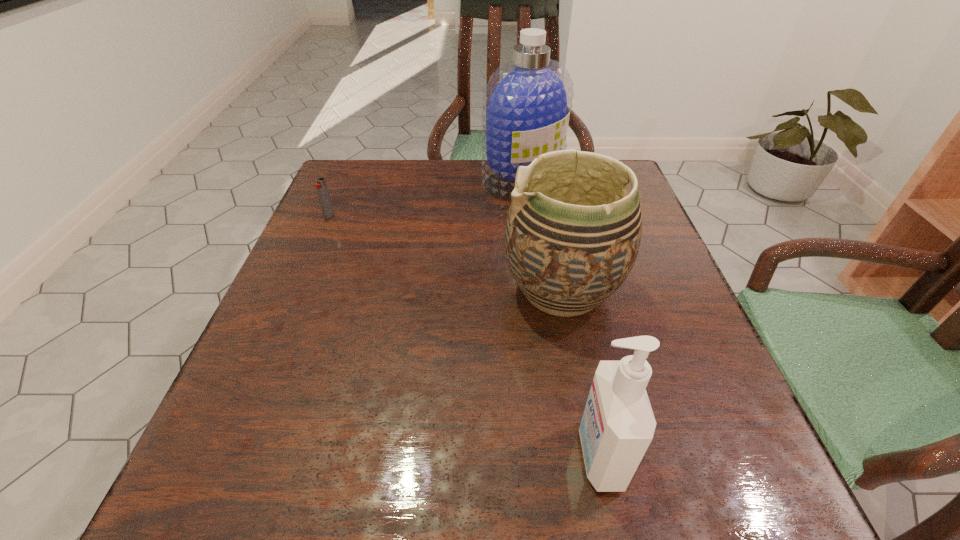
This screenshot has width=960, height=540. What are the coordinates of `the tallest object` in the screenshot? It's located at (526, 104).

Locate an element on the screen. The width and height of the screenshot is (960, 540). the taller cleansing agent is located at coordinates (526, 104).

This screenshot has height=540, width=960. Identify the location of the third farthest object. point(572,236).

Where is `the shorter cleansing agent`? The width and height of the screenshot is (960, 540). the shorter cleansing agent is located at coordinates (618, 424).

Locate an element on the screen. Image resolution: width=960 pixels, height=540 pixels. the nearer cleansing agent is located at coordinates (618, 424).

Where is `igniter`? Image resolution: width=960 pixels, height=540 pixels. igniter is located at coordinates (321, 187).

This screenshot has width=960, height=540. I want to click on the shortest object, so click(x=321, y=187).

You are a GUI agent. You are given a task and a screenshot of the screen. Output one action in this format:
    pyautogui.click(x=<x>, y=<y>)
    Task: Click on the vacant space located 0.080m on the right of the farthest object
    The width and height of the screenshot is (960, 540).
    Given the screenshot: What is the action you would take?
    pyautogui.click(x=595, y=180)

Locate an element on the screen. Image resolution: width=960 pixels, height=540 pixels. blank space located on the back of the third farthest object is located at coordinates (538, 165).

Locate an element on the screen. This screenshot has width=960, height=540. free space located 0.220m on the front label of the shorter cleansing agent is located at coordinates (417, 456).